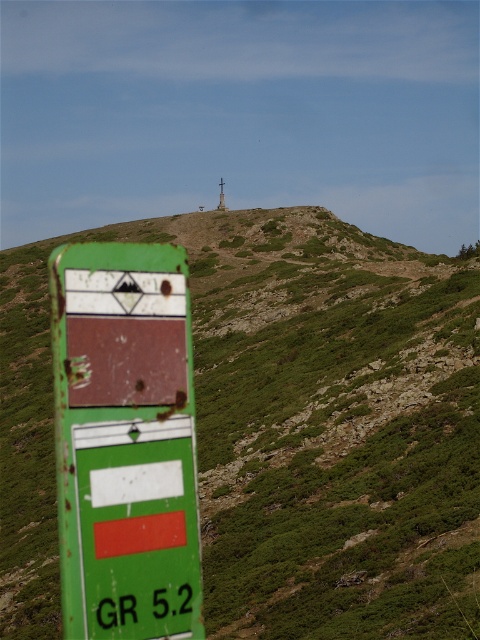
Question: Is green grassy hillside at upper center closer to camera compared to rusty green sign at left?

Choices:
 (A) yes
 (B) no

Answer: (B)

Question: Can you confirm if green grassy hillside at upper center is positioned to the left of rusty green sign at left?

Choices:
 (A) yes
 (B) no

Answer: (A)

Question: Which point is closer to the camera?

Choices:
 (A) green grassy hillside at upper center
 (B) rusty green sign at left

Answer: (B)

Question: Which point is farther to the camera?

Choices:
 (A) green grassy hillside at upper center
 (B) rusty green sign at left

Answer: (A)

Question: Is green grassy hillside at upper center positioned before rusty green sign at left?

Choices:
 (A) yes
 (B) no

Answer: (B)